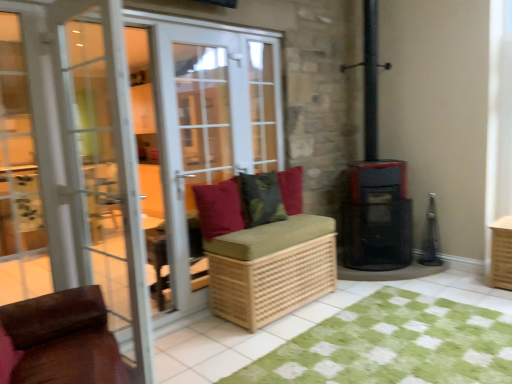
Question: Considering the positions of point (332, 314) and point (234, 200), is point (332, 314) closer or farther from the camera than point (234, 200)?

Choices:
 (A) farther
 (B) closer

Answer: (B)

Question: Based on their positions, is green checkered rug at lower center located to the left or right of velvet red pillow at center, the first pillow positioned from the left?

Choices:
 (A) left
 (B) right

Answer: (B)

Question: Which object is the closest to the matte white screen door at center, which is counted as the 2th screen door, starting from the front?

Choices:
 (A) green checkered rug at lower center
 (B) matte black stove at right
 (C) wooden crate at right
 (D) velvet red pillow at center, the 3th pillow in the right-to-left sequence
 (E) velvet-like green cushion at center, the third pillow viewed from the left

Answer: (D)

Question: Which object is positioned closest to the velvet red pillow at center, the 3th pillow in the right-to-left sequence?

Choices:
 (A) green checkered rug at lower center
 (B) velvet-like green cushion at center, which appears as the first pillow when viewed from the right
 (C) green textured cushion at center, placed as the 2th pillow when sorted from right to left
 (D) wooden crate at right
 (E) white glass door at center

Answer: (C)